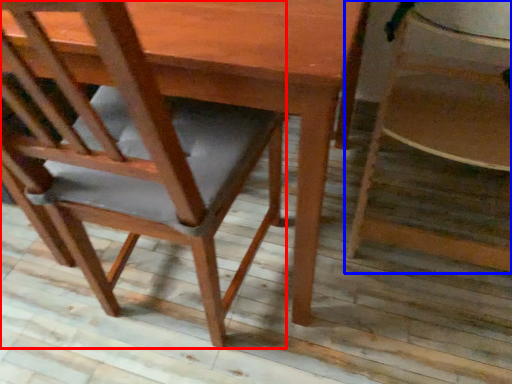
Question: Which of the following is the farthest to the observer, chair (highlighted by a red box) or chair (highlighted by a blue box)?

Choices:
 (A) chair
 (B) chair

Answer: (B)